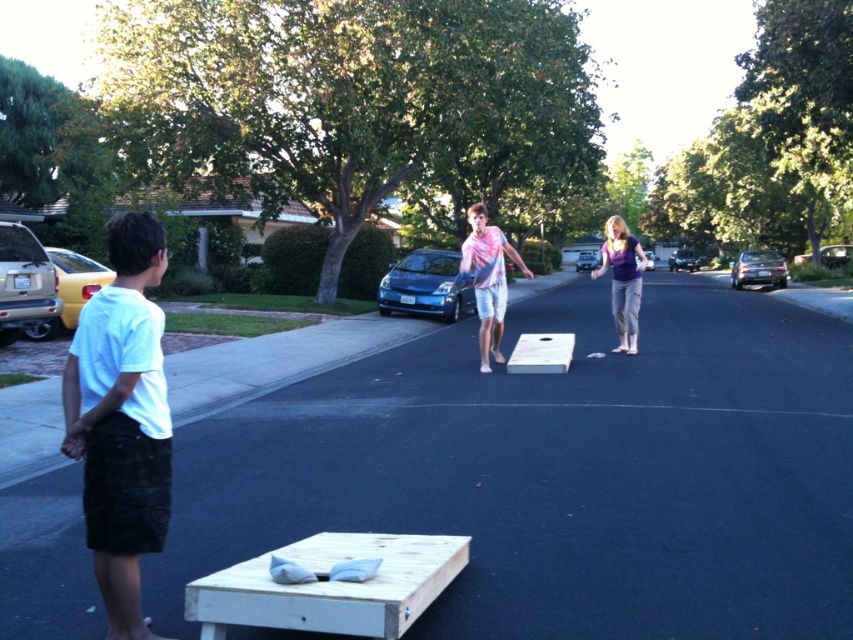
Question: Is white cotton t-shirt at left closer to camera compared to light pink tie-dye shirt at center?

Choices:
 (A) no
 (B) yes

Answer: (B)

Question: Which point appears closest to the camera in this image?

Choices:
 (A) [503, 305]
 (B) [103, 364]

Answer: (B)

Question: Which point is farther from the camera taking this photo?

Choices:
 (A) (469, 205)
 (B) (144, 323)

Answer: (A)

Question: Is white cotton t-shirt at left smaller than light pink tie-dye shirt at center?

Choices:
 (A) no
 (B) yes

Answer: (B)

Question: Which object is closer to the camera taking this photo?

Choices:
 (A) light pink tie-dye shirt at center
 (B) white cotton t-shirt at left

Answer: (B)

Question: Can you confirm if white cotton t-shirt at left is bigger than light pink tie-dye shirt at center?

Choices:
 (A) yes
 (B) no

Answer: (B)